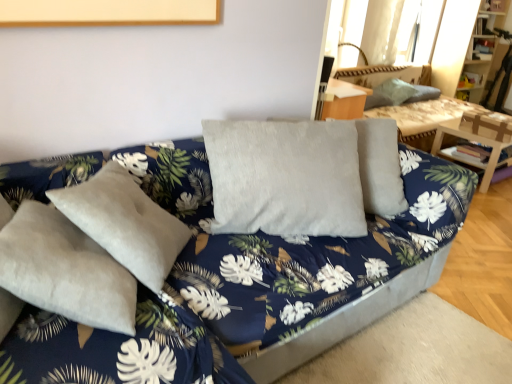
Image resolution: width=512 pixels, height=384 pixels. What do you see at coordinates (400, 31) in the screenshot? I see `translucent fabric curtain at upper right` at bounding box center [400, 31].

Where is `wooden table at right`? wooden table at right is located at coordinates (480, 137).

This screenshot has height=384, width=512. Describe the element at coordinates (483, 51) in the screenshot. I see `wooden bookshelf at upper right` at that location.

Identify the location of translucent fabric curtain at upper right. The height and width of the screenshot is (384, 512). (400, 31).

Is translucent fabric curtain at upper right oriented away from wooden table at right?

That's not correct — translucent fabric curtain at upper right is not looking away from wooden table at right.

From a real-world perspective, between translucent fabric curtain at upper right and wooden table at right, who is vertically higher?

From a 3D spatial view, translucent fabric curtain at upper right is above.

Which is nearer, [367,25] or [507,136]?

The point [507,136] is more forward.

Considering the sizes of objects translucent fabric curtain at upper right and wooden table at right in the image provided, who is smaller, translucent fabric curtain at upper right or wooden table at right?

translucent fabric curtain at upper right is smaller.

How many degrees apart are the facing directions of velvet gray couch at center and velvet green pillow at upper right?

There is a 87.4-degree angle between the facing directions of velvet gray couch at center and velvet green pillow at upper right.

At what (x,y) coordinates should I click in order to perform the action: click on studio couch in front of the velvet green pillow at upper right. Please return your answer as a coordinate pair (x, y). Looking at the image, I should click on (211, 247).

Is velvet gray couch at center at the right side of velvet green pillow at upper right?

No.

Could you tell me if velvet gray couch at center is facing velvet green pillow at upper right?

Yes, velvet gray couch at center is aimed at velvet green pillow at upper right.

How far apart are velvet green pillow at upper right and translucent fabric curtain at upper right?

velvet green pillow at upper right and translucent fabric curtain at upper right are 20.37 inches apart from each other.

From a real-world perspective, which is physically below, velvet green pillow at upper right or translucent fabric curtain at upper right?

From a 3D spatial view, velvet green pillow at upper right is below.

Identify the location of pillow that is in front of the translucent fabric curtain at upper right. Image resolution: width=512 pixels, height=384 pixels. (390, 93).

From their relative heights in the image, would you say velvet green pillow at upper right is taller or shorter than translucent fabric curtain at upper right?

In the image, velvet green pillow at upper right appears to be shorter than translucent fabric curtain at upper right.

In the scene shown: Is wooden table at right spatially inside wooden bookshelf at upper right, or outside of it?

wooden table at right lies outside wooden bookshelf at upper right.

Does wooden table at right have a lesser height compared to wooden bookshelf at upper right?

Yes, wooden table at right is shorter than wooden bookshelf at upper right.

Locate an element on the screen. This screenshot has width=512, height=384. table located below the wooden bookshelf at upper right (from the image's perspective) is located at coordinates (480, 137).

In the scene shown: How many degrees apart are the facing directions of wooden table at right and wooden bookshelf at upper right?

The facing directions of wooden table at right and wooden bookshelf at upper right are 4.51 degrees apart.

Is wooden bookshelf at upper right in front of or behind wooden table at right in the image?

wooden bookshelf at upper right is behind wooden table at right.

In the image, is wooden bookshelf at upper right on the left side or the right side of wooden table at right?

wooden bookshelf at upper right is positioned on wooden table at right's right side.

Considering the points (486, 71) and (457, 131), which point is behind, point (486, 71) or point (457, 131)?

Positioned behind is point (486, 71).

Can we say wooden bookshelf at upper right lies outside wooden table at right?

Yes.

Where is `studio couch to the left of velvet green pillow at upper right`? studio couch to the left of velvet green pillow at upper right is located at coordinates (211, 247).

From the image's perspective, which is below, velvet green pillow at upper right or velvet gray couch at center?

velvet gray couch at center appears lower in the image.

Considering their positions, is wooden table at right located in front of or behind translucent fabric curtain at upper right?

Clearly, wooden table at right is in front of translucent fabric curtain at upper right.

How many degrees apart are the facing directions of wooden table at right and translucent fabric curtain at upper right?

3.15 degrees separate the facing orientations of wooden table at right and translucent fabric curtain at upper right.

Is wooden table at right spatially inside translucent fabric curtain at upper right, or outside of it?

wooden table at right is outside translucent fabric curtain at upper right.

Does wooden table at right touch translucent fabric curtain at upper right?

wooden table at right is not next to translucent fabric curtain at upper right, and they're not touching.

I want to click on table lying below the translucent fabric curtain at upper right (from the image's perspective), so click(480, 137).

Locate an element on the screen. The width and height of the screenshot is (512, 384). studio couch located in front of the velvet green pillow at upper right is located at coordinates (211, 247).

Considering their positions, is wooden table at right positioned closer to velvet gray couch at center than translucent fabric curtain at upper right?

wooden table at right is closer to velvet gray couch at center.

Considering their positions, is wooden bookshelf at upper right positioned further to velvet gray couch at center than velvet gray pillows at upper right?

Among the two, wooden bookshelf at upper right is located further to velvet gray couch at center.

In the scene shown: Based on their spatial positions, is velvet gray pillows at upper right or velvet green pillow at upper right closer to velvet gray couch at center?

Based on the image, velvet gray pillows at upper right appears to be nearer to velvet gray couch at center.

Based on the photo, estimate the real-world distances between objects in this image. Which object is closer to wooden table at right, translucent fabric curtain at upper right or velvet gray couch at center?

translucent fabric curtain at upper right is positioned closer to the anchor wooden table at right.

When comparing their distances from wooden table at right, does velvet gray couch at center or wooden bookshelf at upper right seem closer?

wooden bookshelf at upper right is closer to wooden table at right.

Which object lies further to the anchor point velvet gray couch at center, translucent fabric curtain at upper right or wooden table at right?

translucent fabric curtain at upper right is further to velvet gray couch at center.

When comparing their distances from velvet gray pillows at upper right, does velvet green pillow at upper right or wooden bookshelf at upper right seem further?

wooden bookshelf at upper right.

Which object lies nearer to the anchor point translucent fabric curtain at upper right, velvet green pillow at upper right or wooden bookshelf at upper right?

velvet green pillow at upper right.

The height and width of the screenshot is (384, 512). I want to click on pillow between velvet gray pillows at upper right and wooden bookshelf at upper right from front to back, so click(x=390, y=93).

This screenshot has width=512, height=384. Identify the location of table between velvet gray pillows at upper right and wooden bookshelf at upper right from front to back. (480, 137).

Where is `bookshelf between translucent fabric curtain at upper right and wooden table at right in the vertical direction`? Image resolution: width=512 pixels, height=384 pixels. bookshelf between translucent fabric curtain at upper right and wooden table at right in the vertical direction is located at coordinates (483, 51).

The height and width of the screenshot is (384, 512). Identify the location of couch between velvet gray couch at center and wooden bookshelf at upper right in the front-back direction. coord(421,118).